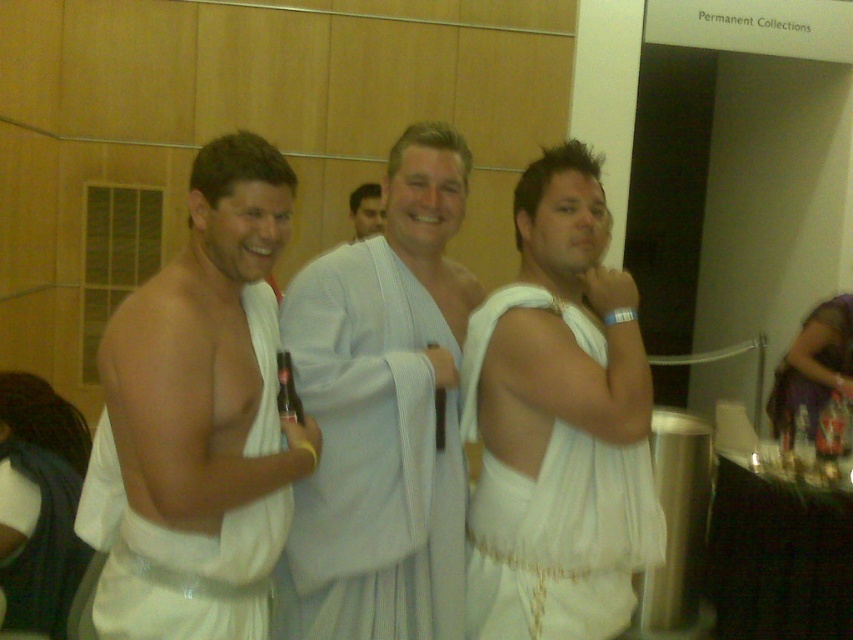
You are a photographer at a themed event and need to ensure that all guests are wearing toga garments of a minimum size requirement. You observe the white cloth toga at left and the white cloth toga at center. Which toga meets the size requirement if the minimum size is larger than the smaller of the two?

The white cloth toga at left meets the size requirement because it is bigger than the white cloth toga at center, which is the smaller one.

You are planning to arrange a photo shoot and need to position two models wearing white cloth toga at left and white cloth toga at center. The photographer requires the models to stand exactly 6 feet apart. Based on the current setup, will the models need to move closer or farther apart to meet the photographer requirement?

→ The current distance between the white cloth toga at left and white cloth toga at center is 6.62 feet. To meet the requirement of 6 feet, the models need to move closer by 0.62 feet.